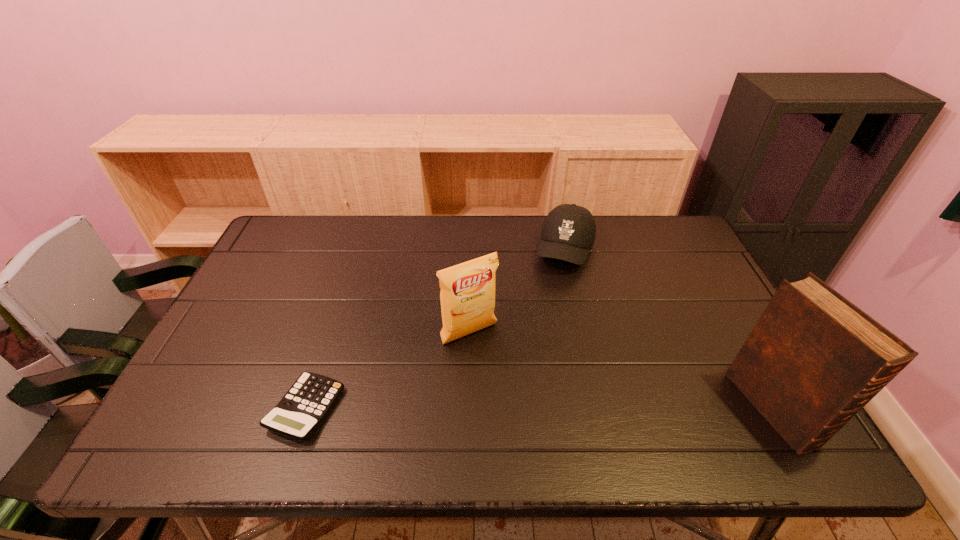
Identify the location of vacant space located 0.150m on the front of the third nearest object with the logo. (512, 391).

Where is `free region located 0.170m on the front of the third nearest object with the logo`? Image resolution: width=960 pixels, height=540 pixels. free region located 0.170m on the front of the third nearest object with the logo is located at coordinates (516, 397).

Locate an element on the screen. This screenshot has width=960, height=540. blank area located on the front of the third nearest object with the logo is located at coordinates (503, 379).

Identify the location of free space located on the front-facing side of the third object from left to right. Image resolution: width=960 pixels, height=540 pixels. (528, 380).

Identify the location of vacant point located 0.190m on the front-facing side of the third object from left to right. The image size is (960, 540). (547, 320).

Image resolution: width=960 pixels, height=540 pixels. In order to click on free space located on the front-facing side of the third object from left to right in this screenshot , I will do `click(553, 300)`.

Identify the location of object located in the far edge section of the desktop. (568, 232).

Find the location of a particular element. calculator situated at the near edge is located at coordinates (305, 405).

Find the location of a particular element. The height and width of the screenshot is (540, 960). Bible present at the near edge is located at coordinates (813, 360).

Where is `object present at the right edge`? This screenshot has height=540, width=960. object present at the right edge is located at coordinates (813, 360).